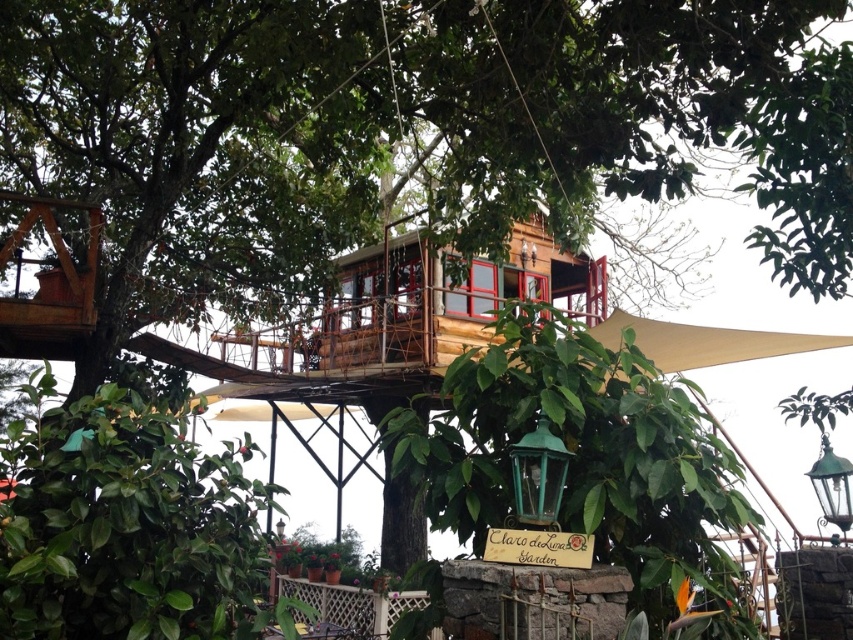
You are planning to install a new wooden deck that is 2 meters wide between the wooden treehouse at center and the beige fabric canopy at lower right. Considering their widths, will the deck fit between them without overlapping either structure?

The wooden treehouse at center is wider than the beige fabric canopy at lower right. Since the deck is 2 meters wide, it depends on the actual widths of both structures. However, the question does not provide specific measurements, so we cannot definitively determine if the deck will fit without overlapping.

You are a visitor standing in front of the wooden treehouse at center and the beige fabric canopy at lower right. Which object is closer to you?

The wooden treehouse at center is closer to you because it is positioned further to the viewer than the beige fabric canopy at lower right, meaning it appears nearer in the scene.